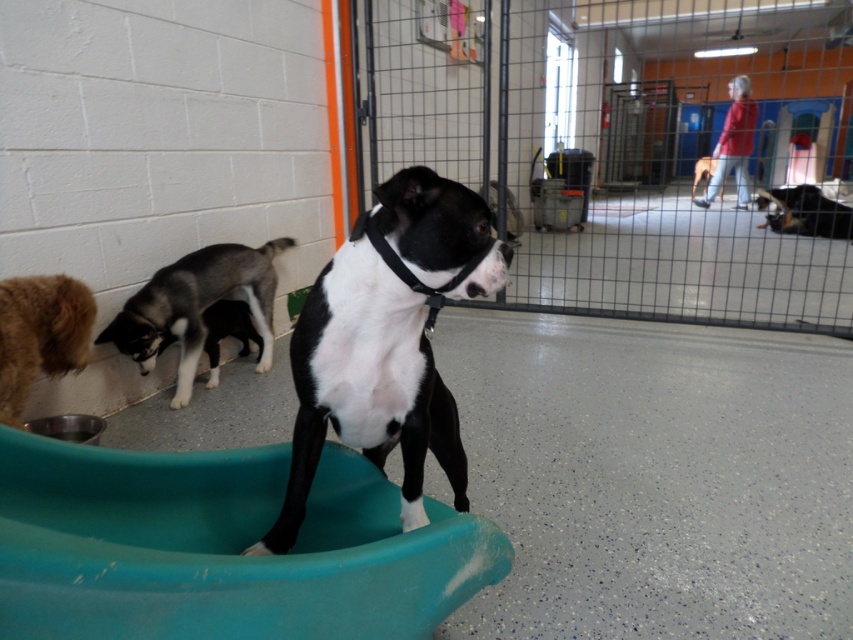
Does brown fluffy dog at lower left have a lesser height compared to black glossy dog at upper right?

Indeed, brown fluffy dog at lower left has a lesser height compared to black glossy dog at upper right.

Who is positioned more to the right, brown fluffy dog at lower left or black glossy dog at upper right?

black glossy dog at upper right is more to the right.

Find the location of a particular element. brown fluffy dog at lower left is located at coordinates (39, 333).

Is point (363, 227) farther from viewer compared to point (697, 161)?

No, it is in front of (697, 161).

Is black matte dog at center shorter than black smooth dog at center?

In fact, black matte dog at center may be taller than black smooth dog at center.

Looking at this image, who is more distant from viewer, (303, 404) or (704, 164)?

The point (704, 164) is behind.

Identify the location of black matte dog at center. (387, 340).

Does gray fur dog at lower left have a greater width compared to black smooth dog at center?

In fact, gray fur dog at lower left might be narrower than black smooth dog at center.

The image size is (853, 640). Identify the location of gray fur dog at lower left. (196, 307).

The image size is (853, 640). I want to click on gray fur dog at lower left, so click(x=196, y=307).